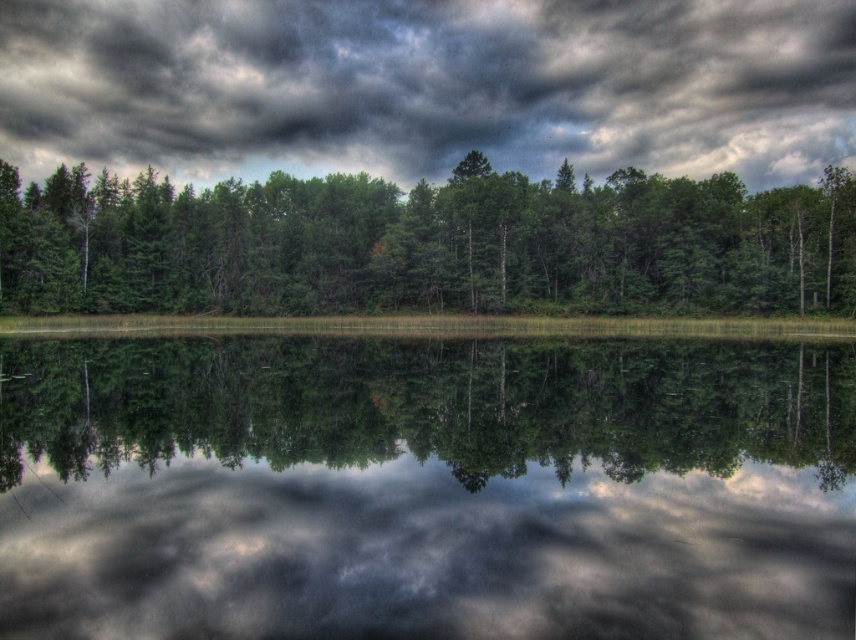
You are standing at the lakeside and want to take a photo of the smooth reflective water at center and the green matte forest at center. Which object will appear closer to you in the photo?

The smooth reflective water at center will appear closer to you in the photo because it is positioned in front of the green matte forest at center.